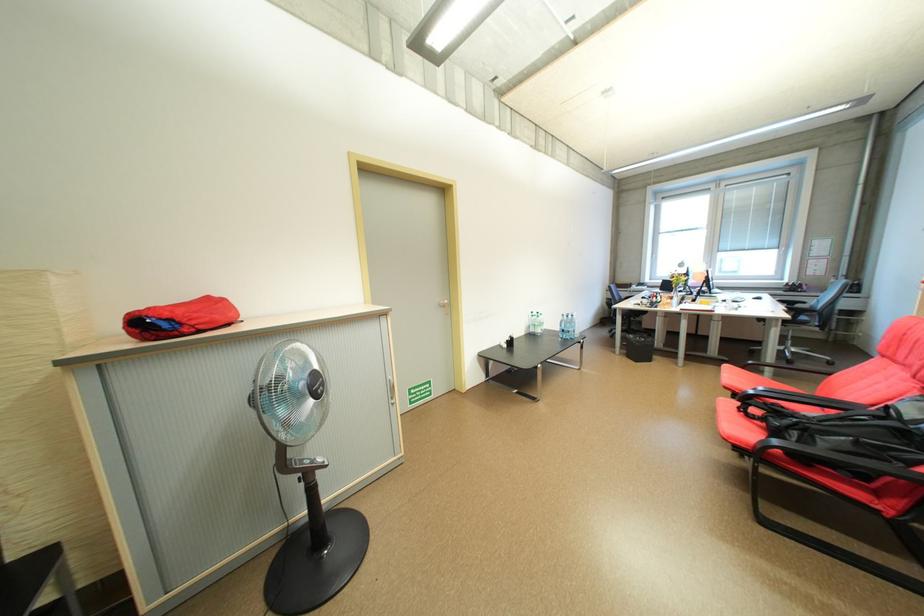
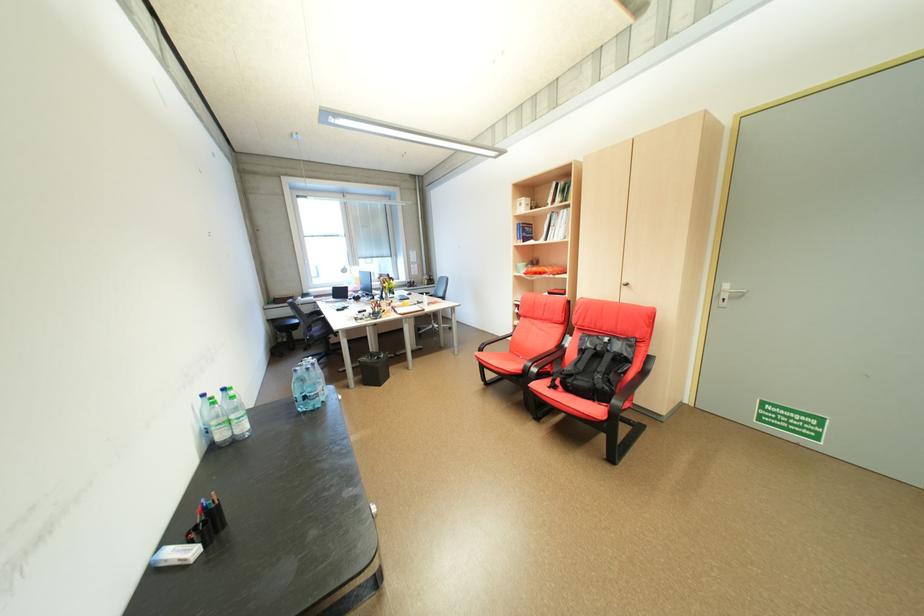
In the second image, find the point that corresponds to pixel 573 331 in the first image.

(313, 398)